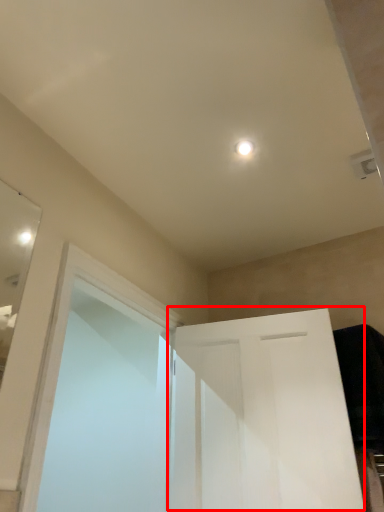
Question: Observing the image, what is the correct spatial positioning of door (annotated by the red box) in reference to screen door?

Choices:
 (A) right
 (B) left

Answer: (A)